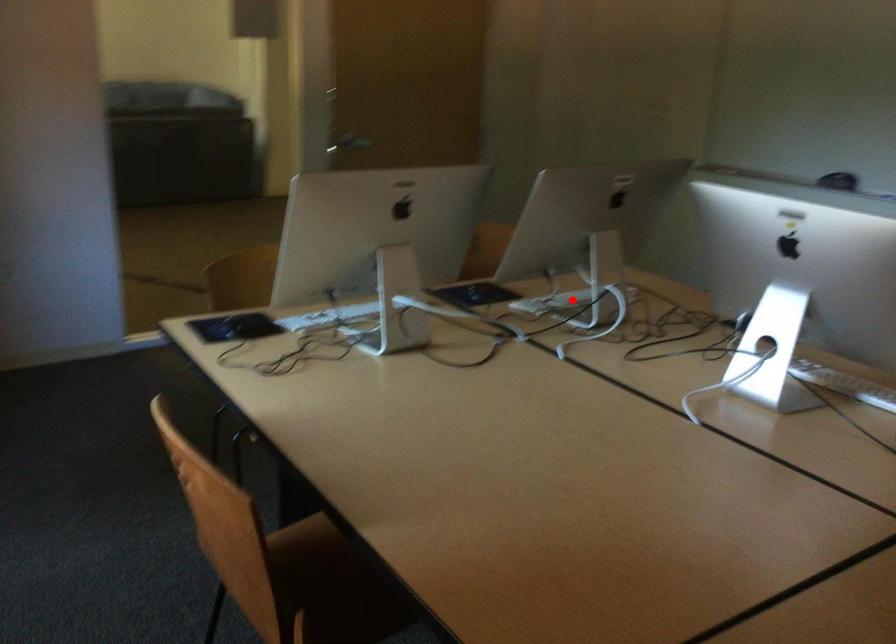
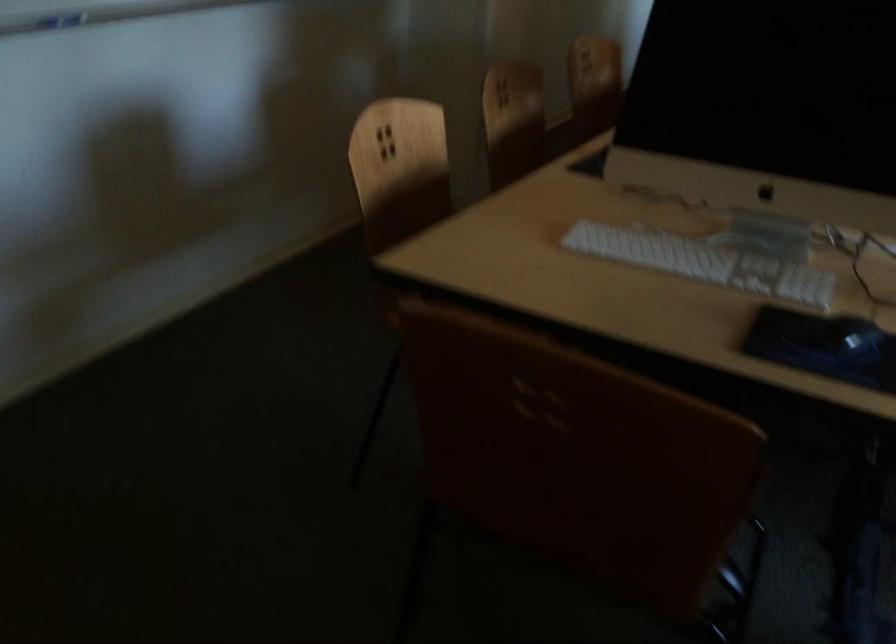
Find the pixel in the second image that matches the highlighted location in the first image.

(702, 261)